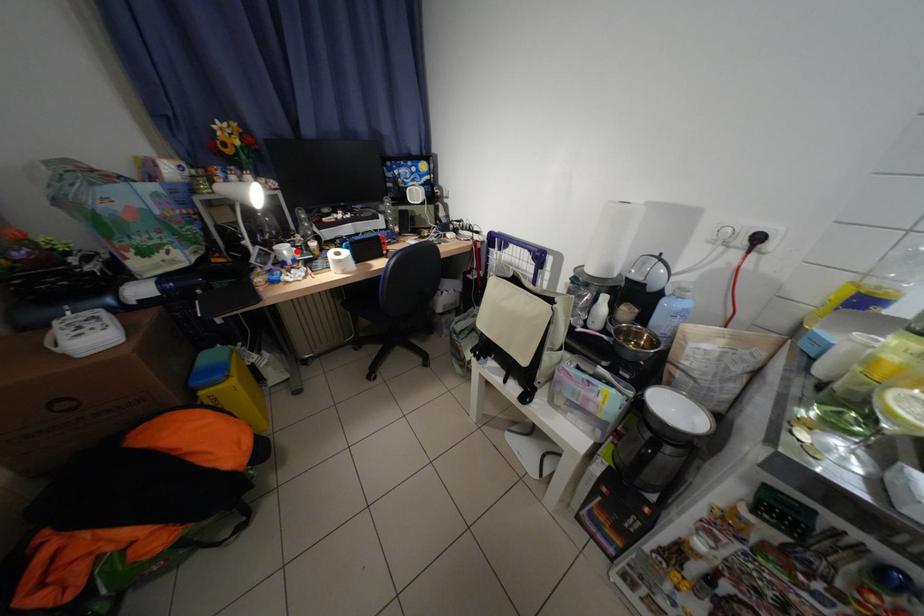
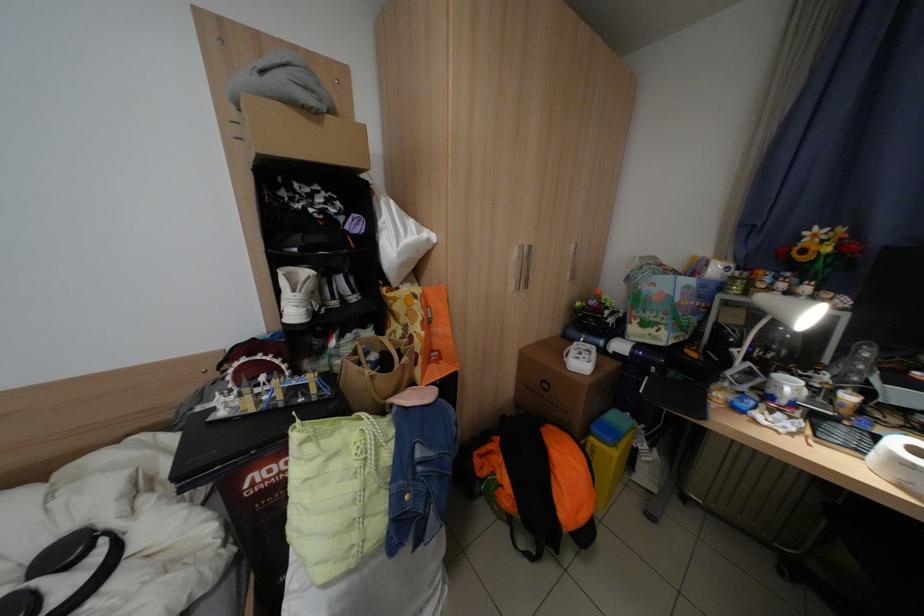
Find the pixel in the second image that matches the highlighted location in the first image.

(800, 387)